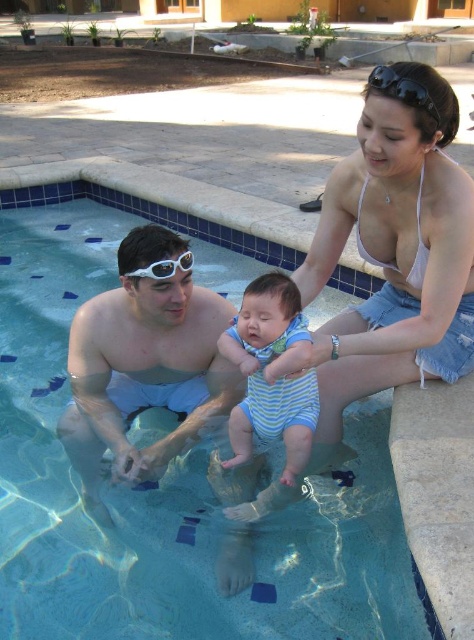
How much distance is there between white plastic goggles at center and blue tile swimming pool at center?

The distance of white plastic goggles at center from blue tile swimming pool at center is 5.88 feet.

Is white plastic goggles at center bigger than blue tile swimming pool at center?

Actually, white plastic goggles at center might be smaller than blue tile swimming pool at center.

Who is more forward, (x=166, y=252) or (x=119, y=202)?

Point (x=166, y=252) is in front.

This screenshot has width=474, height=640. I want to click on white plastic goggles at center, so click(144, 364).

Between striped cotton onesie at center and white matte goggles at upper center, which one is positioned higher?

white matte goggles at upper center

Who is positioned more to the right, striped cotton onesie at center or white matte goggles at upper center?

striped cotton onesie at center is more to the right.

Which is in front, point (299, 461) or point (125, 273)?

Point (299, 461) is more forward.

The height and width of the screenshot is (640, 474). In order to click on striped cotton onesie at center in this screenshot , I will do `click(272, 372)`.

Can you confirm if white plastic goggles at center is taller than white matte goggles at upper center?

Indeed, white plastic goggles at center has a greater height compared to white matte goggles at upper center.

Does white plastic goggles at center appear under white matte goggles at upper center?

Correct, white plastic goggles at center is located below white matte goggles at upper center.

Between point (134, 333) and point (136, 273), which one is positioned behind?

Positioned behind is point (134, 333).

Find the location of a particular element. This screenshot has width=474, height=640. white plastic goggles at center is located at coordinates (144, 364).